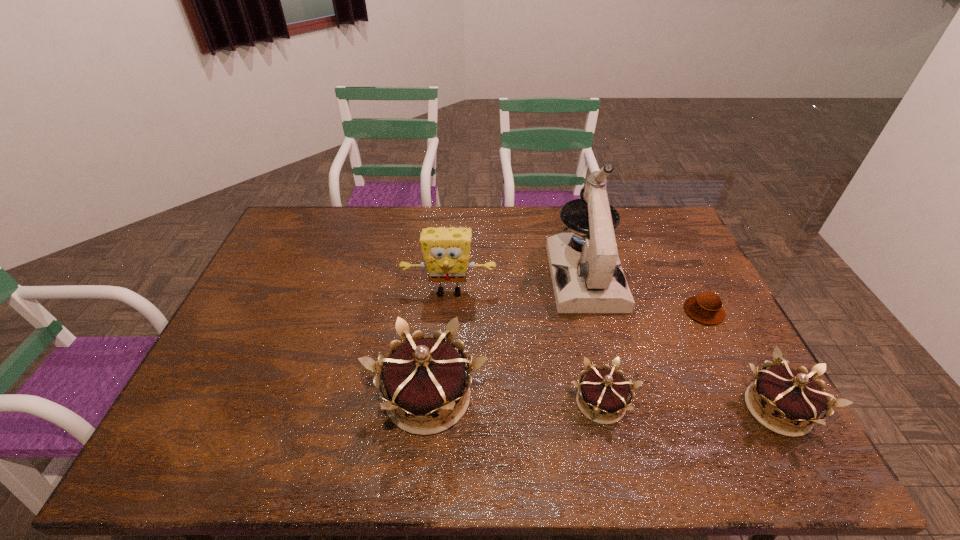
I want to click on vacant region between the leftmost crown and the fifth tallest object, so click(515, 400).

Identify the location of empty location between the rightmost crown and the second crown from left to right. This screenshot has height=540, width=960. (689, 406).

This screenshot has height=540, width=960. In order to click on free space between the shortest object and the tallest object in this screenshot , I will do `click(644, 293)`.

I want to click on empty location between the shortest object and the second crown from right to left, so click(x=653, y=357).

You are a GUI agent. You are given a task and a screenshot of the screen. Output one action in this format:
    pyautogui.click(x=<x>, y=<y>)
    Task: Click on the fourth closest object to the sponge
    Image resolution: width=960 pixels, height=540 pixels.
    Given the screenshot: What is the action you would take?
    pyautogui.click(x=706, y=307)

Choose which object is the nearest neighbor to the muffin. Please provide its 2D coordinates. Your answer should be formatted as a tuple, i.e. [(x, y)], where the tuple contains the x and y coordinates of a point satisfying the conditions above.

[(592, 281)]

Locate which crown ranks second in proximity to the microscope. Please provide its 2D coordinates. Your answer should be formatted as a tuple, i.e. [(x, y)], where the tuple contains the x and y coordinates of a point satisfying the conditions above.

[(425, 377)]

Select which crown appears as the closest to the tallest crown. Please provide its 2D coordinates. Your answer should be formatted as a tuple, i.e. [(x, y)], where the tuple contains the x and y coordinates of a point satisfying the conditions above.

[(606, 392)]

The height and width of the screenshot is (540, 960). I want to click on blank area in the image that satisfies the following two spatial constraints: 1. on the face of the shortest crown; 2. on the right side of the sponge, so click(x=442, y=403).

Identify the location of vacant space that satisfies the following two spatial constraints: 1. on the face of the sponge; 2. on the left side of the shortest object. The image size is (960, 540). (447, 311).